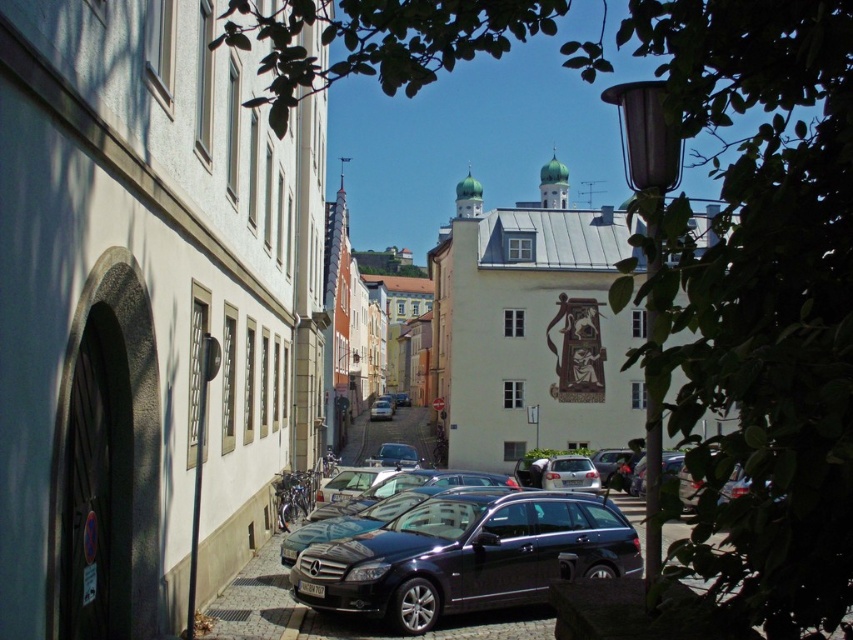
Based on the photo, can you confirm if white matte car at center is positioned below shiny silver sedan at center?

Actually, white matte car at center is above shiny silver sedan at center.

Between white matte car at center and shiny silver sedan at center, which one has more height?

shiny silver sedan at center is taller.

The width and height of the screenshot is (853, 640). Describe the element at coordinates (570, 474) in the screenshot. I see `white matte car at center` at that location.

Locate an element on the screen. The height and width of the screenshot is (640, 853). white matte car at center is located at coordinates (570, 474).

From the picture: Which is above, shiny silver sedan at center or satin silver sedan at center?

shiny silver sedan at center is above.

Consider the image. Which of these two, shiny silver sedan at center or satin silver sedan at center, stands shorter?

satin silver sedan at center

Between point (409, 465) and point (374, 413), which one is positioned in front?

Point (409, 465) is more forward.

The height and width of the screenshot is (640, 853). Find the location of `shiny silver sedan at center`. shiny silver sedan at center is located at coordinates (395, 456).

The height and width of the screenshot is (640, 853). What do you see at coordinates (466, 556) in the screenshot?
I see `glossy black car at center` at bounding box center [466, 556].

Is point (483, 536) positioned in front of point (579, 476)?

That is True.

Locate an element on the screen. glossy black car at center is located at coordinates (466, 556).

I want to click on glossy black car at center, so click(466, 556).